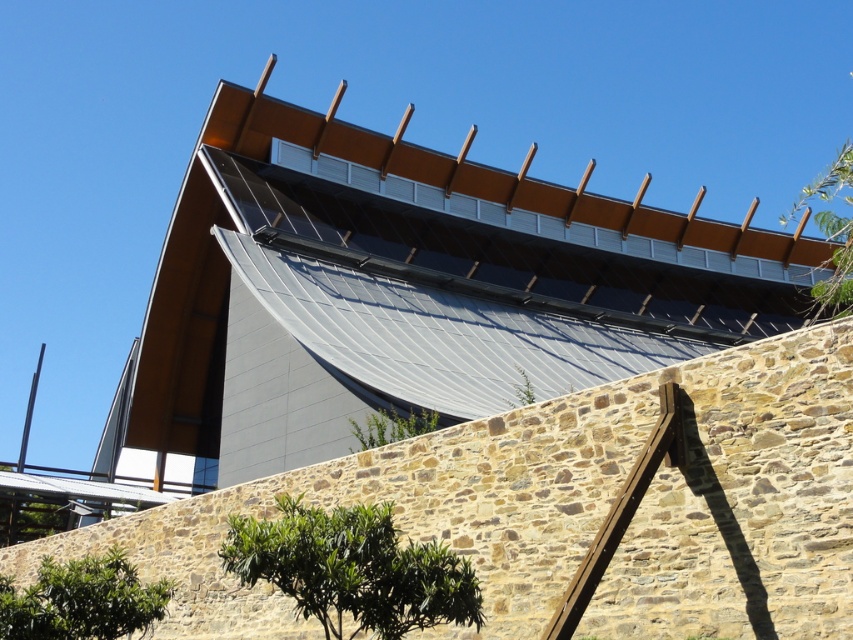
Which is in front, point (363, 388) or point (120, 604)?

Positioned in front is point (120, 604).

Is metallic gray roof at upper center wider than green leafy tree at lower left?

Correct, the width of metallic gray roof at upper center exceeds that of green leafy tree at lower left.

From the picture: Who is more forward, (144, 397) or (80, 628)?

Point (80, 628)

Where is `metallic gray roof at upper center`? The height and width of the screenshot is (640, 853). metallic gray roof at upper center is located at coordinates (409, 291).

Does green leafy tree at lower center have a smaller size compared to green leafy tree at upper right?

Yes, green leafy tree at lower center is smaller than green leafy tree at upper right.

Is green leafy tree at lower center thinner than green leafy tree at upper right?

Yes, green leafy tree at lower center is thinner than green leafy tree at upper right.

Find the location of a particular element. Image resolution: width=853 pixels, height=640 pixels. green leafy tree at lower center is located at coordinates [x=352, y=568].

You are a GUI agent. You are given a task and a screenshot of the screen. Output one action in this format:
    pyautogui.click(x=<x>, y=<y>)
    Task: Click on the green leafy tree at lower center
    The image size is (853, 640).
    Given the screenshot: What is the action you would take?
    pyautogui.click(x=352, y=568)

Is point (207, 467) in front of point (293, 593)?

No, it is behind (293, 593).

Is point (405, 301) in front of point (461, 611)?

No, it is not.

I want to click on metallic gray roof at upper center, so click(409, 291).